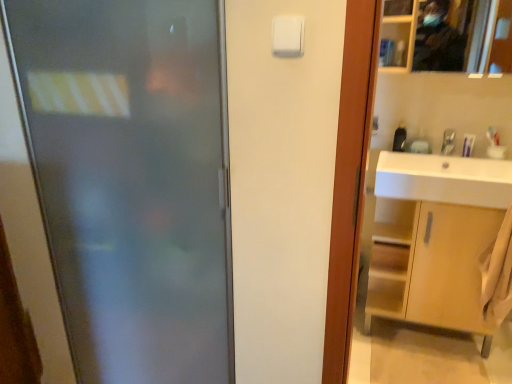
Locate an element on the screen. The image size is (512, 384). frosted glass door at left is located at coordinates (131, 180).

What is the approximate width of white plastic light switch at upper center?

white plastic light switch at upper center is 0.87 inches in width.

I want to click on white plastic light switch at upper center, so click(288, 36).

Measure the distance between point (452, 157) and camera.

6.80 feet.

Where is `light brown wood cabinet at right`? This screenshot has height=384, width=512. light brown wood cabinet at right is located at coordinates (434, 270).

The image size is (512, 384). Describe the element at coordinates (447, 36) in the screenshot. I see `metallic reflective mirror at upper right` at that location.

Identify the location of silver metallic faucet at upper right. (448, 142).

Locate an element on the screen. This screenshot has width=512, height=384. mirror located above the silver metallic faucet at upper right (from the image's perspective) is located at coordinates (447, 36).

Is point (386, 50) behind point (442, 149)?

Yes, point (386, 50) is behind point (442, 149).

From a real-world perspective, is metallic reflective mirror at upper right positioned above or below silver metallic faucet at upper right?

Clearly, from a real-world perspective, metallic reflective mirror at upper right is above silver metallic faucet at upper right.

Is metallic reflective mirror at upper right outside of silver metallic faucet at upper right?

Yes, metallic reflective mirror at upper right is not within silver metallic faucet at upper right.

This screenshot has width=512, height=384. Find the location of `light switch on the left side of silver metallic faucet at upper right`. light switch on the left side of silver metallic faucet at upper right is located at coordinates (288, 36).

Which object is positioned more to the left, white plastic light switch at upper center or silver metallic faucet at upper right?

white plastic light switch at upper center is more to the left.

From the image's perspective, is white plastic light switch at upper center above or below silver metallic faucet at upper right?

Clearly, from the image's perspective, white plastic light switch at upper center is above silver metallic faucet at upper right.

From a real-world perspective, which is physically below, white plastic light switch at upper center or silver metallic faucet at upper right?

silver metallic faucet at upper right is physically lower.

Can you tell me how much frosted glass door at left and white plastic light switch at upper center differ in facing direction?

0.00693 degrees.

Which point is more distant from viewer, (86, 224) or (276, 36)?

The point (86, 224) is farther from the camera.

Does frosted glass door at left come in front of white plastic light switch at upper center?

No, frosted glass door at left is further to the viewer.

Is frosted glass door at left aimed at white plastic light switch at upper center?

No, frosted glass door at left is not turned towards white plastic light switch at upper center.

Is white glossy sink at right at the left side of metallic reflective mirror at upper right?

Yes.

Do you think white glossy sink at right is within metallic reflective mirror at upper right, or outside of it?

white glossy sink at right is outside metallic reflective mirror at upper right.

Is point (408, 187) less distant than point (401, 67)?

Yes, point (408, 187) is closer to viewer.

Would you say metallic reflective mirror at upper right contains frosted glass door at left?

No, frosted glass door at left is not surrounded by metallic reflective mirror at upper right.

Is metallic reflective mirror at upper right positioned far away from frosted glass door at left?

Yes, metallic reflective mirror at upper right and frosted glass door at left are quite far apart.

From a real-world perspective, which is physically above, metallic reflective mirror at upper right or frosted glass door at left?

metallic reflective mirror at upper right, from a real-world perspective.

Considering the sizes of objects metallic reflective mirror at upper right and frosted glass door at left in the image provided, who is taller, metallic reflective mirror at upper right or frosted glass door at left?

With more height is frosted glass door at left.

Image resolution: width=512 pixels, height=384 pixels. Find the location of `mirror in front of the white glossy sink at right`. mirror in front of the white glossy sink at right is located at coordinates (447, 36).

Is point (478, 20) positioned after point (429, 173)?

Yes.

From a real-world perspective, between metallic reflective mirror at upper right and white glossy sink at right, who is vertically lower?

white glossy sink at right, from a real-world perspective.

Looking at this image, is metallic reflective mirror at upper right positioned with its back to white glossy sink at right?

metallic reflective mirror at upper right is not turned away from white glossy sink at right.

From a real-world perspective, is light brown wood cabinet at right positioned over metallic reflective mirror at upper right based on gravity?

No.

Is light brown wood cabinet at right taller or shorter than metallic reflective mirror at upper right?

In the image, light brown wood cabinet at right appears to be taller than metallic reflective mirror at upper right.

Is light brown wood cabinet at right closer to camera compared to metallic reflective mirror at upper right?

No, the depth of light brown wood cabinet at right is greater than that of metallic reflective mirror at upper right.

Can we say light brown wood cabinet at right lies outside metallic reflective mirror at upper right?

Yes.

You are a GUI agent. You are given a task and a screenshot of the screen. Output one action in this format:
    pyautogui.click(x=<x>, y=<y>)
    Task: Click on the mirror above the silver metallic faucet at upper right (from the image's perspective)
    
    Given the screenshot: What is the action you would take?
    pyautogui.click(x=447, y=36)

This screenshot has height=384, width=512. Find the location of `faucet directly beneath the white plastic light switch at upper center (from a real-world perspective)`. faucet directly beneath the white plastic light switch at upper center (from a real-world perspective) is located at coordinates (448, 142).

Based on their spatial positions, is light brown wood cabinet at right or white glossy sink at right closer to metallic reflective mirror at upper right?

white glossy sink at right is closer to metallic reflective mirror at upper right.

Looking at the image, which one is located closer to metallic reflective mirror at upper right, light brown wood cabinet at right or silver metallic faucet at upper right?

Based on the image, silver metallic faucet at upper right appears to be nearer to metallic reflective mirror at upper right.

Based on their spatial positions, is light brown wood cabinet at right or metallic reflective mirror at upper right further from frosted glass door at left?

Among the two, metallic reflective mirror at upper right is located further to frosted glass door at left.

Consider the image. Based on their spatial positions, is silver metallic faucet at upper right or frosted glass door at left closer to metallic reflective mirror at upper right?

silver metallic faucet at upper right is positioned closer to the anchor metallic reflective mirror at upper right.

Considering their positions, is white plastic light switch at upper center positioned further to frosted glass door at left than light brown wood cabinet at right?

light brown wood cabinet at right is positioned further to the anchor frosted glass door at left.

Looking at this image, estimate the real-world distances between objects in this image. Which object is closer to white plastic light switch at upper center, white glossy sink at right or metallic reflective mirror at upper right?

white glossy sink at right lies closer to white plastic light switch at upper center than the other object.

Estimate the real-world distances between objects in this image. Which object is closer to light brown wood cabinet at right, silver metallic faucet at upper right or white glossy sink at right?

white glossy sink at right is closer to light brown wood cabinet at right.

When comparing their distances from metallic reflective mirror at upper right, does silver metallic faucet at upper right or white plastic light switch at upper center seem further?

white plastic light switch at upper center lies further to metallic reflective mirror at upper right than the other object.

Find the location of a particular element. This screenshot has width=512, height=384. bathroom cabinet between frosted glass door at left and white glossy sink at right is located at coordinates (434, 270).

Where is `light switch situated between frosted glass door at left and metallic reflective mirror at upper right from left to right`? Image resolution: width=512 pixels, height=384 pixels. light switch situated between frosted glass door at left and metallic reflective mirror at upper right from left to right is located at coordinates (288, 36).

I want to click on mirror located between frosted glass door at left and silver metallic faucet at upper right in the left-right direction, so click(447, 36).

Find the location of `bathroom cabinet between frosted glass door at left and silver metallic faucet at upper right`. bathroom cabinet between frosted glass door at left and silver metallic faucet at upper right is located at coordinates (434, 270).